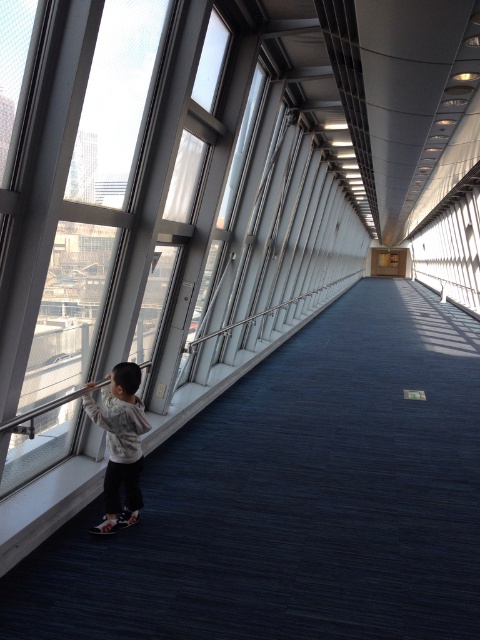
Question: Is smooth concrete ledge at left below light gray sweater at left?

Choices:
 (A) no
 (B) yes

Answer: (A)

Question: Which point is closer to the camera taking this photo?

Choices:
 (A) (152, 413)
 (B) (110, 472)

Answer: (B)

Question: Does smooth concrete ledge at left appear on the right side of light gray sweater at left?

Choices:
 (A) yes
 (B) no

Answer: (A)

Question: Which point is farther from the camera taking this photo?

Choices:
 (A) (29, 545)
 (B) (117, 387)

Answer: (B)

Question: Which object appears farthest from the camera in this image?

Choices:
 (A) light gray sweater at left
 (B) smooth concrete ledge at left

Answer: (A)

Question: Is smooth concrete ledge at left to the left of light gray sweater at left from the viewer's perspective?

Choices:
 (A) yes
 (B) no

Answer: (B)